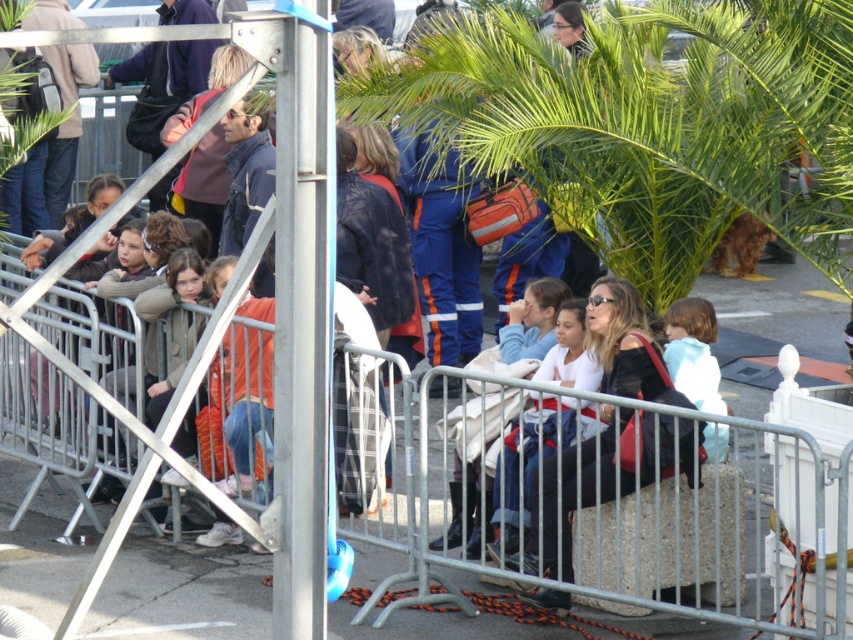
Based on the photo, you are organizing a small event and need to determine which item is narrower between the light blue fabric at center and the light blue denim jacket at center. Based on the scene, which one should you choose?

The light blue fabric at center has a lesser width compared to the light blue denim jacket at center, so you should choose the light blue fabric at center if you need a narrower item.

In the scene, where is the silver metallic pole at center located in terms of coordinates?

The silver metallic pole at center is located at coordinates point (300, 328).